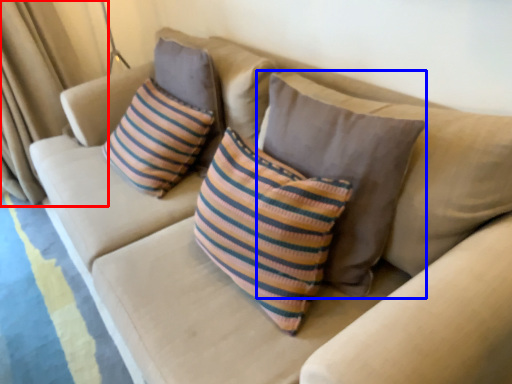
Question: Which object is further to the camera taking this photo, curtain (highlighted by a red box) or pillow (highlighted by a blue box)?

Choices:
 (A) curtain
 (B) pillow

Answer: (A)